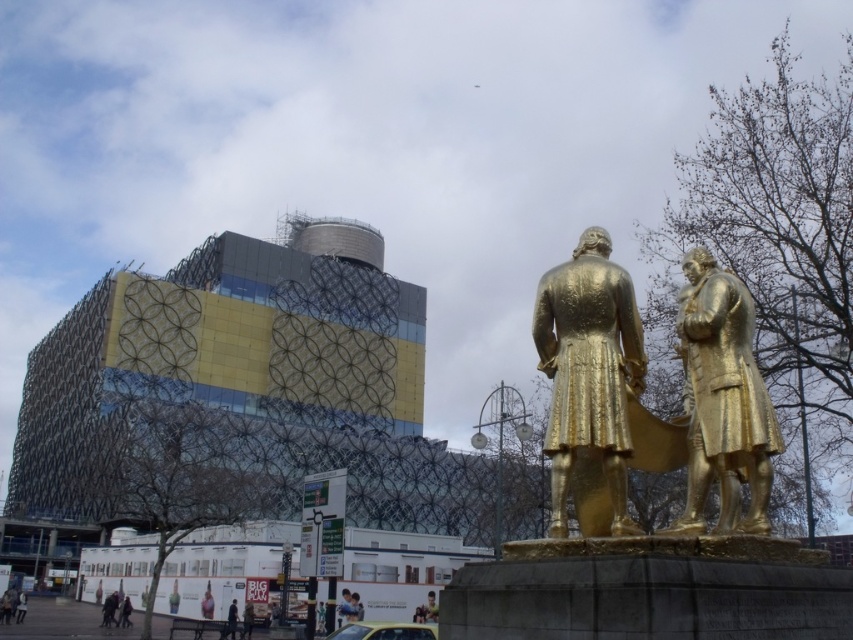
Question: Is light brown wooden bench at lower center to the left of green fabric person at lower left from the viewer's perspective?

Choices:
 (A) no
 (B) yes

Answer: (A)

Question: Does gold polished statue at right appear on the right side of green fabric person at lower left?

Choices:
 (A) no
 (B) yes

Answer: (B)

Question: Which object appears closest to the camera in this image?

Choices:
 (A) green fabric person at lower left
 (B) golden statue at center
 (C) smooth pink dress at lower center

Answer: (B)

Question: Can you confirm if light brown wooden bench at lower center is bigger than green fabric person at lower left?

Choices:
 (A) no
 (B) yes

Answer: (A)

Question: Which object is closer to the camera taking this photo?

Choices:
 (A) light brown wooden bench at lower center
 (B) green fabric person at lower left
 (C) gold polished statue at right

Answer: (C)

Question: Which of the following is the farthest from the observer?

Choices:
 (A) golden statue at center
 (B) gold metallic statue at center

Answer: (A)